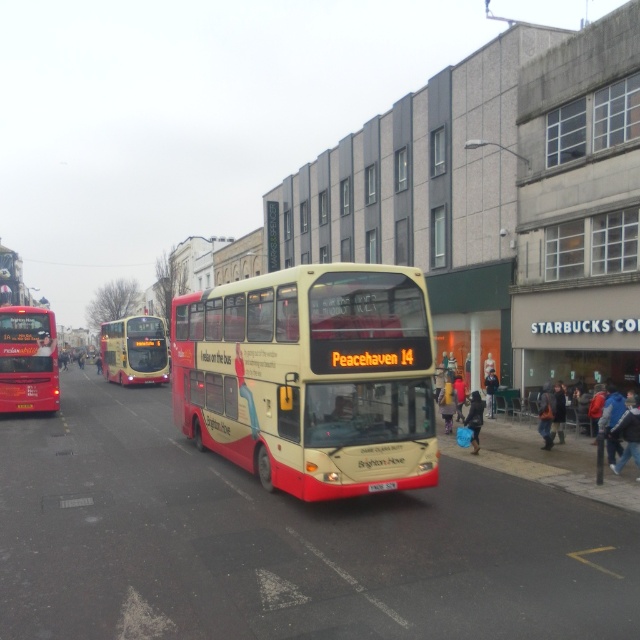
Who is shorter, yellow matte bus at center or white plastic license plate at center?

Standing shorter between the two is white plastic license plate at center.

I want to click on yellow matte bus at center, so click(134, 349).

Locate an element on the screen. yellow matte bus at center is located at coordinates (134, 349).

Identify the location of yellow matte bus at center. The height and width of the screenshot is (640, 640). click(x=134, y=349).

Is point (376, 492) in front of point (26, 403)?

Yes, point (376, 492) is in front of point (26, 403).

The image size is (640, 640). I want to click on white plastic license plate at center, so click(x=381, y=486).

Is matte red bus at left bigger than yellow matte bus at center?

Incorrect, matte red bus at left is not larger than yellow matte bus at center.

Who is lower down, matte red bus at left or yellow matte bus at center?

yellow matte bus at center is lower down.

Which is behind, point (12, 310) or point (129, 332)?

Point (129, 332)

The height and width of the screenshot is (640, 640). I want to click on matte red bus at left, so click(x=28, y=358).